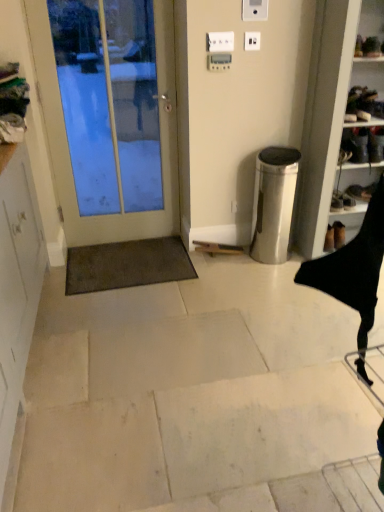
Question: Which is correct: black leather shoes at right is inside white plastic electric outlet at upper center, which appears as the 1th electric outlet when viewed from the right, or outside of it?

Choices:
 (A) inside
 (B) outside

Answer: (B)

Question: Is black leather shoes at right taller or shorter than white plastic electric outlet at upper center, which is the second electric outlet in left-to-right order?

Choices:
 (A) tall
 (B) short

Answer: (A)

Question: Estimate the real-world distances between objects in this image. Which object is farther from the white plastic electric outlet at upper center, arranged as the first electric outlet when viewed from the left?

Choices:
 (A) brown shaggy mat at lower left
 (B) white glossy door at left
 (C) black leather shoes at right
 (D) white plastic electric outlet at upper center, which is the second electric outlet in left-to-right order
 (E) white matte cabinet at left

Answer: (E)

Question: Estimate the real-world distances between objects in this image. Which object is farther from the brown shaggy mat at lower left?

Choices:
 (A) black leather shoes at right
 (B) white matte cabinet at left
 (C) white plastic electric outlet at upper center, which is the second electric outlet in left-to-right order
 (D) white plastic electric outlet at upper center, which appears as the 2th electric outlet when viewed from the right
 (E) white glossy door at left

Answer: (C)